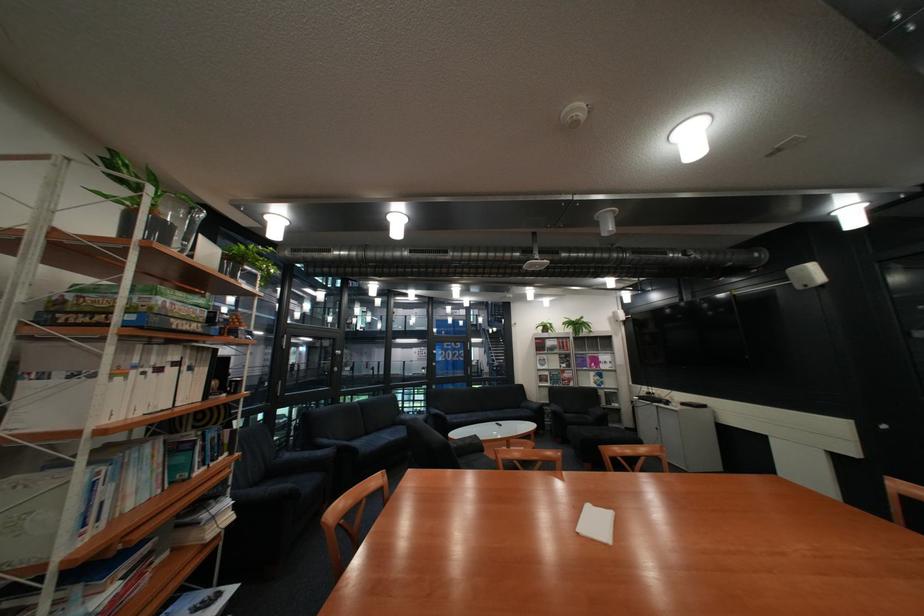
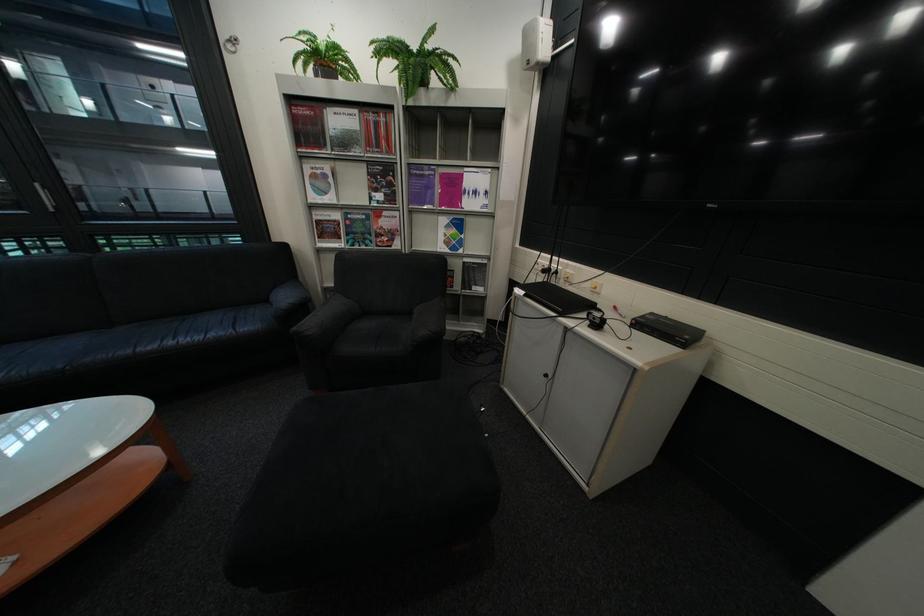
Where in the second image is the point corresponding to pixel 652 398 from the first image?

(538, 293)